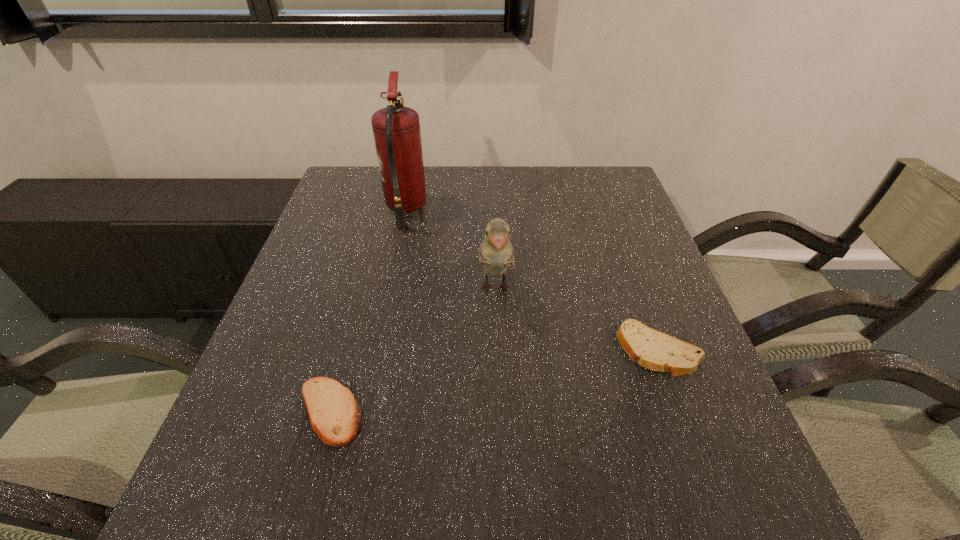
I want to click on free location located on the front of the nearest object, so click(x=311, y=477).

Find the location of `free space located on the left of the rightmost object`. free space located on the left of the rightmost object is located at coordinates (528, 350).

This screenshot has height=540, width=960. Find the location of `object positioned at the far edge`. object positioned at the far edge is located at coordinates (396, 129).

Where is `object that is at the left edge`? This screenshot has width=960, height=540. object that is at the left edge is located at coordinates (334, 414).

Locate an element on the screen. Image resolution: width=960 pixels, height=540 pixels. object that is at the right edge is located at coordinates (654, 350).

The image size is (960, 540). In the image, there is a desktop. Identify the location of vacant area at the far edge. (447, 186).

Find the location of `vacant space at the near edge of the desktop`. vacant space at the near edge of the desktop is located at coordinates (367, 486).

Identify the location of free space at the left edge. Image resolution: width=960 pixels, height=540 pixels. (360, 217).

You are a GUI agent. You are given a task and a screenshot of the screen. Output one action in this format:
    pyautogui.click(x=<x>, y=<y>)
    Task: Click on the free space at the right edge of the desktop
    The width and height of the screenshot is (960, 540).
    Given the screenshot: What is the action you would take?
    pyautogui.click(x=631, y=268)

I want to click on free space at the far left corner, so click(371, 180).